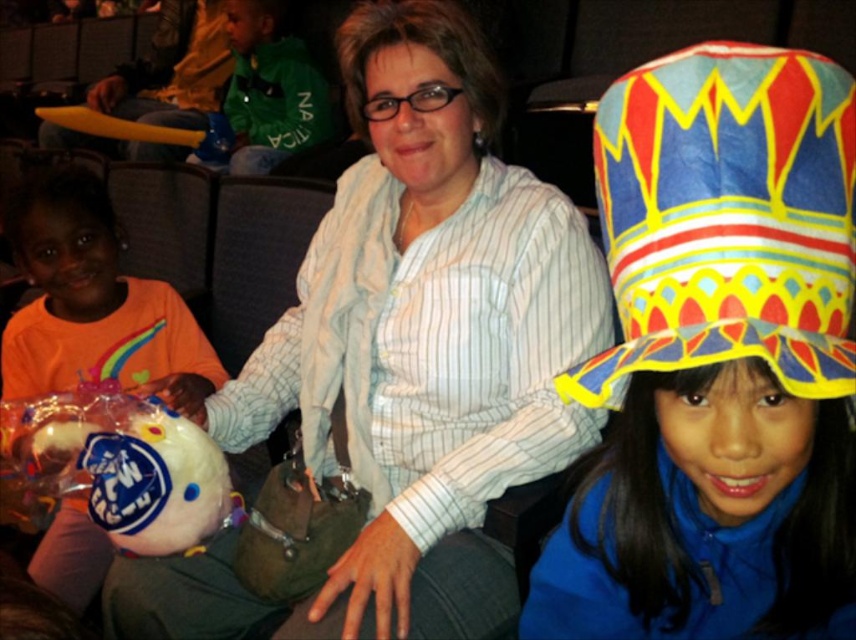
Which is more to the right, paper crown at upper right or orange fabric plush toy at left?

paper crown at upper right is more to the right.

In the scene shown: How distant is paper crown at upper right from orange fabric plush toy at left?

paper crown at upper right is 37.54 inches from orange fabric plush toy at left.

Does point (715, 56) lie in front of point (61, 244)?

Yes, it is in front of point (61, 244).

At what (x,y) coordinates should I click in order to perform the action: click on paper crown at upper right. Please return your answer as a coordinate pair (x, y). Looking at the image, I should click on (727, 218).

Can you confirm if white striped shirt at center is bigger than paper crown at upper right?

Yes.

Describe the element at coordinates (428, 333) in the screenshot. I see `white striped shirt at center` at that location.

Where is `white striped shirt at center`? This screenshot has width=856, height=640. white striped shirt at center is located at coordinates (428, 333).

Which is more to the left, white striped shirt at center or orange fabric plush toy at left?

From the viewer's perspective, orange fabric plush toy at left appears more on the left side.

This screenshot has height=640, width=856. Describe the element at coordinates (428, 333) in the screenshot. I see `white striped shirt at center` at that location.

Locate an element on the screen. The width and height of the screenshot is (856, 640). white striped shirt at center is located at coordinates (428, 333).